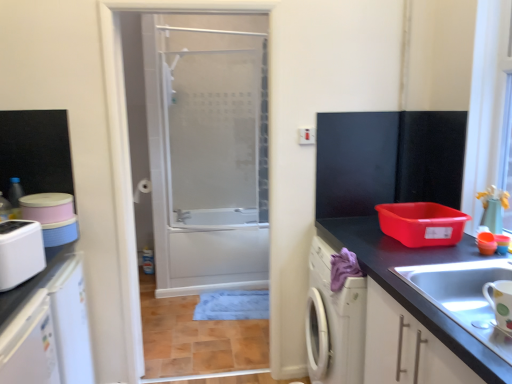
The height and width of the screenshot is (384, 512). What are the coordinates of `white plastic toaster at left, positioned as the 2th appliance in right-to-left order` in the screenshot? It's located at (20, 252).

This screenshot has width=512, height=384. What do you see at coordinates (500, 302) in the screenshot? I see `white glossy mug at lower right, the 2th appliance positioned from the left` at bounding box center [500, 302].

Describe the element at coordinates (207, 150) in the screenshot. The width and height of the screenshot is (512, 384). I see `transparent glass door at center` at that location.

Identify the location of transparent glass door at center. (207, 150).

In order to click on matte black countertop at right in this screenshot , I will do `click(408, 285)`.

You are a GUI agent. You are given a task and a screenshot of the screen. Output one action in this format:
    pyautogui.click(x=<x>, y=<y>)
    Task: Click on the matte silver faucet at upper center
    This screenshot has width=512, height=384.
    Given the screenshot: What is the action you would take?
    pyautogui.click(x=182, y=216)

Is the surface of white glossy mug at lower right, marked as the 2th appliance in a back-to-front arrangement, in direct contact with white matte cabinet at lower right?

white glossy mug at lower right, marked as the 2th appliance in a back-to-front arrangement, is not next to white matte cabinet at lower right, and they're not touching.

Is white glossy mug at lower right, the 2th appliance positioned from the left, closer to camera compared to white matte cabinet at lower right?

No.

Which is behind, point (496, 293) or point (439, 382)?

Point (439, 382)

Is matte silver faucet at upper center wider or thinner than transparent glass door at center?

Considering their sizes, matte silver faucet at upper center looks broader than transparent glass door at center.

Can we say matte silver faucet at upper center lies outside transparent glass door at center?

matte silver faucet at upper center lies outside transparent glass door at center's area.

Is point (182, 221) farther from camera compared to point (263, 73)?

No.

Is matte silver faucet at upper center positioned before white plastic toaster at left, acting as the first appliance starting from the left?

That is False.

In the scene shown: Do you think matte silver faucet at upper center is within white plastic toaster at left, arranged as the 1th appliance when viewed from the back, or outside of it?

The correct answer is: outside.

Is matte silver faucet at upper center far away from white plastic toaster at left, arranged as the 1th appliance when viewed from the back?

Yes, matte silver faucet at upper center is far from white plastic toaster at left, arranged as the 1th appliance when viewed from the back.

Is white plastic toaster at left, arranged as the second appliance when viewed from the front, taller than matte silver faucet at upper center?

Yes, white plastic toaster at left, arranged as the second appliance when viewed from the front, is taller than matte silver faucet at upper center.

Relative to matte silver faucet at upper center, is white plastic toaster at left, positioned as the 2th appliance in right-to-left order, in front or behind?

white plastic toaster at left, positioned as the 2th appliance in right-to-left order, is positioned closer to the viewer than matte silver faucet at upper center.

From a real-world perspective, is white plastic toaster at left, arranged as the 1th appliance when viewed from the back, on matte silver faucet at upper center?

Indeed, from a real-world perspective, white plastic toaster at left, arranged as the 1th appliance when viewed from the back, stands above matte silver faucet at upper center.

Would you consider white matte cabinet at lower right to be distant from matte silver faucet at upper center?

white matte cabinet at lower right is far away from matte silver faucet at upper center.

Does white matte cabinet at lower right lie in front of matte silver faucet at upper center?

Yes, it is in front of matte silver faucet at upper center.

Can you confirm if white matte cabinet at lower right is taller than matte silver faucet at upper center?

Yes, white matte cabinet at lower right is taller than matte silver faucet at upper center.

The image size is (512, 384). In order to click on cabinetry lying on the right of matte silver faucet at upper center in this screenshot , I will do `click(405, 346)`.

From the image's perspective, is white plastic toaster at left, arranged as the second appliance when viewed from the front, on white glossy mug at lower right, which ranks as the 1th appliance in front-to-back order?

Correct, white plastic toaster at left, arranged as the second appliance when viewed from the front, appears higher than white glossy mug at lower right, which ranks as the 1th appliance in front-to-back order, in the image.

Relative to white glossy mug at lower right, the 2th appliance positioned from the left, is white plastic toaster at left, positioned as the 2th appliance in right-to-left order, in front or behind?

white plastic toaster at left, positioned as the 2th appliance in right-to-left order, is behind white glossy mug at lower right, the 2th appliance positioned from the left.

Is point (4, 275) closer or farther from the camera than point (508, 288)?

Clearly, point (4, 275) is more distant from the camera than point (508, 288).

Is white plastic toaster at left, positioned as the 2th appliance in right-to-left order, looking in the opposite direction of white glossy mug at lower right, the 2th appliance positioned from the left?

No.

How many degrees apart are the facing directions of white glossy mug at lower right, marked as the 2th appliance in a back-to-front arrangement, and matte silver faucet at upper center?

The facing directions of white glossy mug at lower right, marked as the 2th appliance in a back-to-front arrangement, and matte silver faucet at upper center are 178 degrees apart.

How much distance is there between white glossy mug at lower right, marked as the 1th appliance in a right-to-left arrangement, and matte silver faucet at upper center?

The distance of white glossy mug at lower right, marked as the 1th appliance in a right-to-left arrangement, from matte silver faucet at upper center is 2.60 meters.

At what (x,y) coordinates should I click in order to perform the action: click on the 2nd appliance in front of the matte silver faucet at upper center. Please return your answer as a coordinate pair (x, y). Image resolution: width=512 pixels, height=384 pixels. Looking at the image, I should click on (500, 302).

Is matte silver faucet at upper center inside white glossy mug at lower right, the 2th appliance positioned from the left?

Definitely not — matte silver faucet at upper center is not inside white glossy mug at lower right, the 2th appliance positioned from the left.

From the white matte cabinet at lower right, count 1st appliances backward and point to it. Please provide its 2D coordinates.

[(500, 302)]

You are a GUI agent. You are given a task and a screenshot of the screen. Output one action in this format:
    pyautogui.click(x=<x>, y=<y>)
    Task: Click on the faucet on the left of transparent glass door at center
    
    Given the screenshot: What is the action you would take?
    pyautogui.click(x=182, y=216)

When comparing their distances from matte black countertop at right, does white plastic toaster at left, arranged as the 1th appliance when viewed from the back, or matte silver faucet at upper center seem closer?

The object closer to matte black countertop at right is white plastic toaster at left, arranged as the 1th appliance when viewed from the back.

Estimate the real-world distances between objects in this image. Which object is further from white plastic toaster at left, acting as the first appliance starting from the left, matte silver faucet at upper center or white matte cabinet at lower right?

matte silver faucet at upper center lies further to white plastic toaster at left, acting as the first appliance starting from the left, than the other object.

Based on their spatial positions, is matte black countertop at right or white matte cabinet at lower right further from white plastic toaster at left, positioned as the 2th appliance in right-to-left order?

white matte cabinet at lower right.

Considering their positions, is white matte cabinet at lower right positioned further to matte silver faucet at upper center than transparent glass door at center?

Among the two, white matte cabinet at lower right is located further to matte silver faucet at upper center.

Based on their spatial positions, is white glossy mug at lower right, the 2th appliance positioned from the left, or matte silver faucet at upper center closer to transparent glass door at center?

Among the two, matte silver faucet at upper center is located nearer to transparent glass door at center.

Considering their positions, is matte silver faucet at upper center positioned closer to white glossy mug at lower right, marked as the 2th appliance in a back-to-front arrangement, than white plastic toaster at left, arranged as the 1th appliance when viewed from the back?

Among the two, white plastic toaster at left, arranged as the 1th appliance when viewed from the back, is located nearer to white glossy mug at lower right, marked as the 2th appliance in a back-to-front arrangement.

Based on their spatial positions, is transparent glass door at center or white plastic toaster at left, arranged as the 1th appliance when viewed from the back, closer to matte black countertop at right?

white plastic toaster at left, arranged as the 1th appliance when viewed from the back.

Which object lies further to the anchor point white matte cabinet at lower right, matte black countertop at right or white glossy mug at lower right, which ranks as the 1th appliance in front-to-back order?

white glossy mug at lower right, which ranks as the 1th appliance in front-to-back order.

This screenshot has width=512, height=384. Identify the location of countertop between white glossy mug at lower right, the 2th appliance positioned from the left, and matte silver faucet at upper center from front to back. (408, 285).

Image resolution: width=512 pixels, height=384 pixels. What are the coordinates of `countertop situated between transparent glass door at center and white glossy mug at lower right, marked as the 2th appliance in a back-to-front arrangement, from left to right` in the screenshot? It's located at (408, 285).

You are a GUI agent. You are given a task and a screenshot of the screen. Output one action in this format:
    pyautogui.click(x=<x>, y=<y>)
    Task: Click on the door located between white plastic toaster at left, arranged as the 1th appliance when viewed from the back, and white glossy mug at lower right, which ranks as the 1th appliance in front-to-back order, in the left-right direction
    The height and width of the screenshot is (384, 512).
    Given the screenshot: What is the action you would take?
    pyautogui.click(x=207, y=150)

Identify the location of door between white plastic toaster at left, arranged as the second appliance when viewed from the front, and matte black countertop at right, in the horizontal direction. (207, 150).